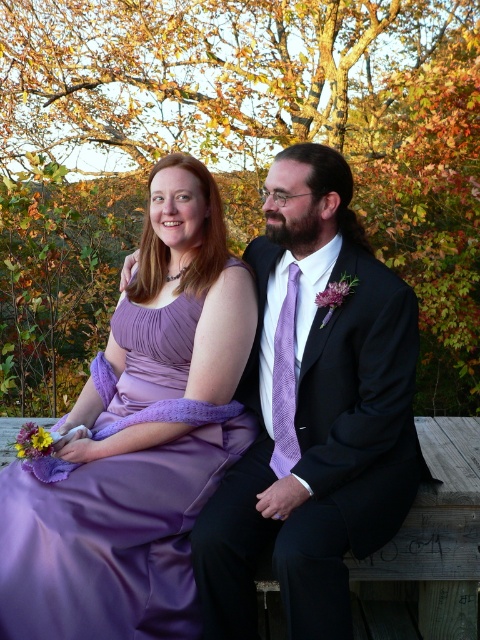
Is lavender satin dress at center smaller than matte black suit at center?

Incorrect, lavender satin dress at center is not smaller in size than matte black suit at center.

Does point (156, 189) come closer to viewer compared to point (317, 168)?

No.

The width and height of the screenshot is (480, 640). What are the coordinates of `lavender satin dress at center` in the screenshot? It's located at (139, 440).

The height and width of the screenshot is (640, 480). I want to click on matte black suit at center, so click(313, 413).

This screenshot has width=480, height=640. What are the coordinates of `matte black suit at center` in the screenshot? It's located at (313, 413).

Is lavender satin dress at center taller than lavender textured tie at center?

Yes.

Who is more forward, (112, 458) or (288, 337)?

Point (112, 458) is in front.

Between point (199, 396) and point (283, 448), which one is positioned behind?

The point (283, 448) is more distant.

The height and width of the screenshot is (640, 480). In order to click on lavender satin dress at center in this screenshot , I will do `click(139, 440)`.